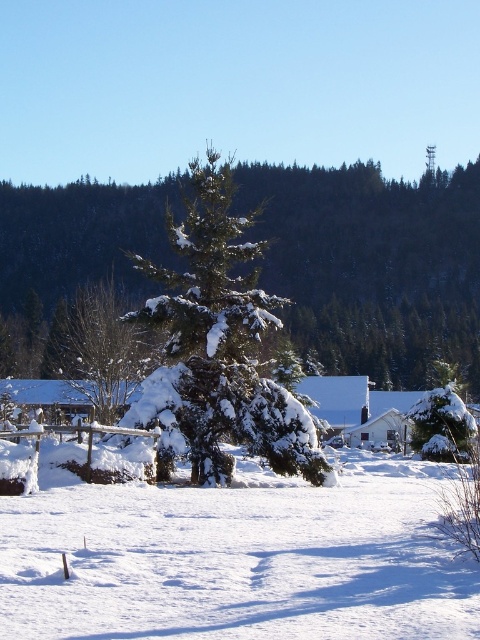
Based on the photo, who is taller, white fluffy snow at center or white matte house at center?

Standing taller between the two is white fluffy snow at center.

Is white fluffy snow at center further to camera compared to white matte house at center?

No.

Which is behind, point (228, 612) or point (393, 444)?

Positioned behind is point (393, 444).

At what (x,y) coordinates should I click in order to perform the action: click on white fluffy snow at center. Please return your answer as a coordinate pair (x, y). This screenshot has width=480, height=640. Looking at the image, I should click on (239, 560).

Does white fluffy snow at center have a smaller size compared to snow-covered evergreen tree at center?

Yes.

Which is in front, point (432, 625) or point (124, 353)?

Point (432, 625) is more forward.

Is point (133, 566) closer to camera compared to point (106, 296)?

That is True.

Where is `white fluffy snow at center`? white fluffy snow at center is located at coordinates (239, 560).

Between point (70, 346) and point (365, 448), which one is positioned behind?

Point (365, 448)

Does snow-covered evergreen tree at center have a smaller size compared to white matte house at center?

Actually, snow-covered evergreen tree at center might be larger than white matte house at center.

Where is `snow-covered evergreen tree at center`? Image resolution: width=480 pixels, height=640 pixels. snow-covered evergreen tree at center is located at coordinates (98, 349).

Identify the location of snow-covered evergreen tree at center. (98, 349).